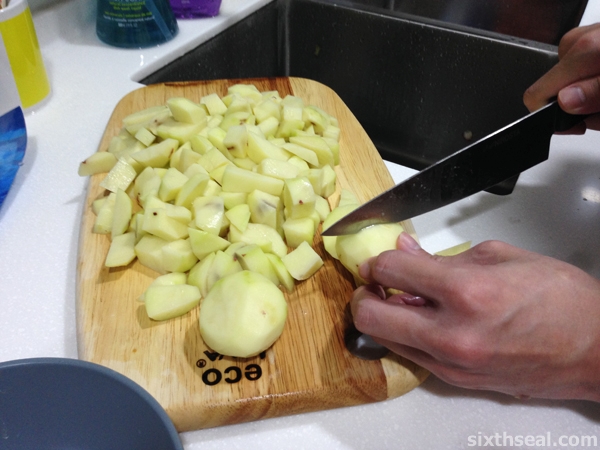
You are a GUI agent. You are given a task and a screenshot of the screen. Output one action in this format:
    pyautogui.click(x=<x>, y=<y>)
    Task: Click on the kitchen cutting knife
    
    Given the screenshot: What is the action you would take?
    pyautogui.click(x=467, y=179)